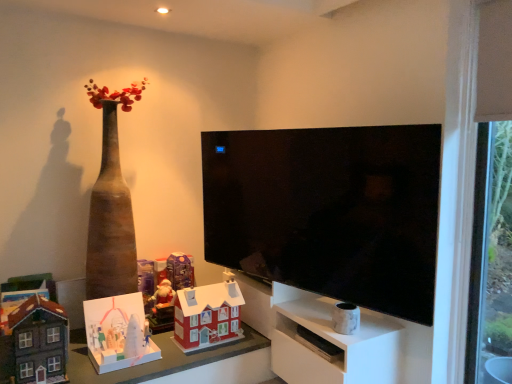
The image size is (512, 384). Find the location of `free spot to the left of white marble vase at lower right, which is counted as the 1th toy, starting from the right`. free spot to the left of white marble vase at lower right, which is counted as the 1th toy, starting from the right is located at coordinates (318, 324).